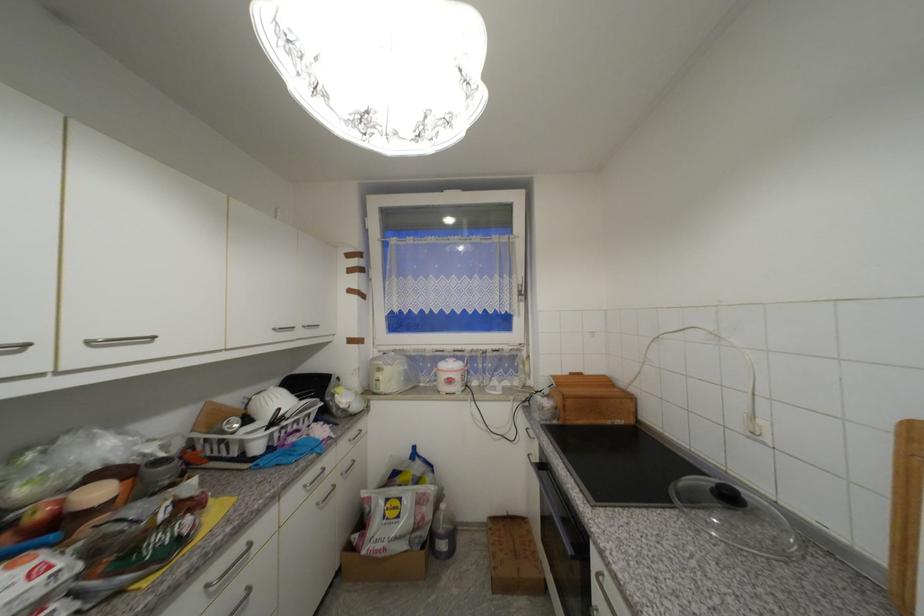
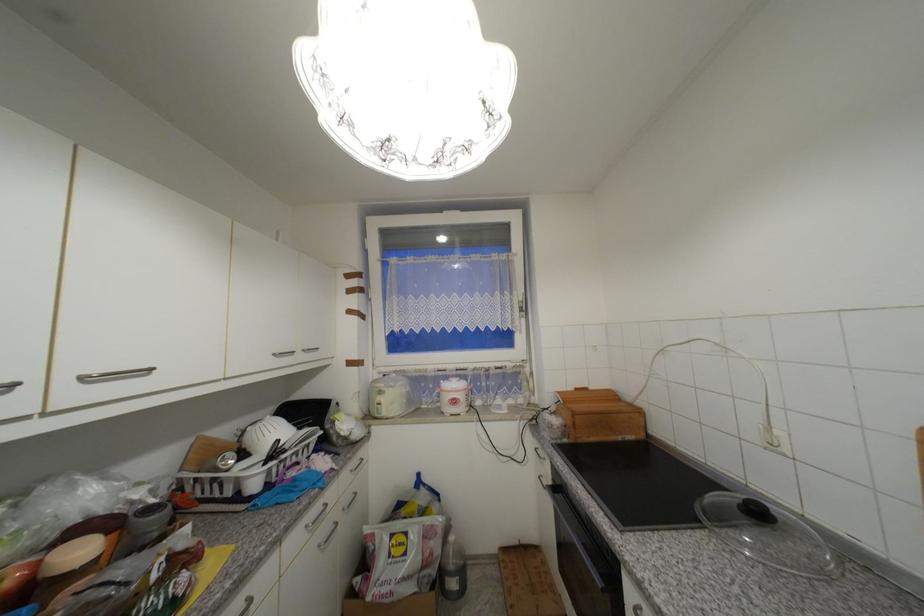
Locate, in the second image, the point that corresponds to (519,277) in the first image.

(520, 294)